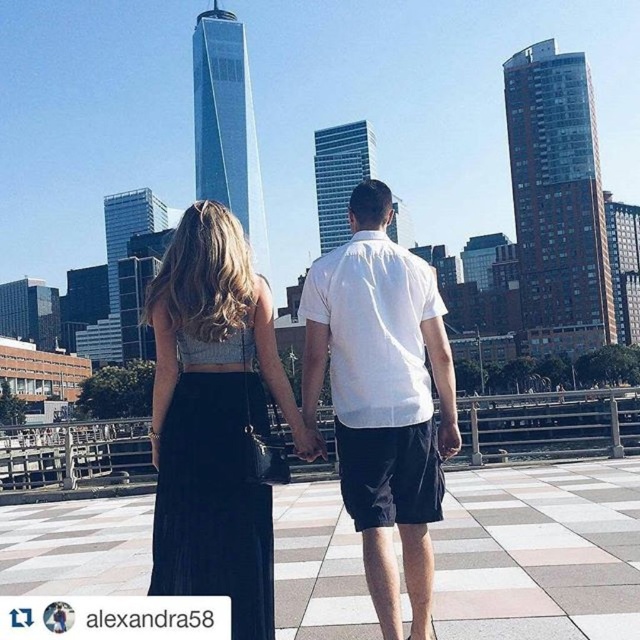
You are a photographer trying to capture the couple in the scene. You notice the satin black skirt at center and the white cotton shirt at center. Which clothing item is located to the left when looking at the couple from the front?

The satin black skirt at center is positioned on the left side of white cotton shirt at center, so when viewed from the front, the satin black skirt at center is to the left of the white cotton shirt at center.

You are a photographer trying to capture a candid shot of the couple in the scene. You notice the satin black skirt at center and the matte black hand at center. To ensure both elements are in focus, you need to know their distance apart. Can you determine if they are within the camera lens depth of field range of 30 inches?

The satin black skirt at center and the matte black hand at center are 33.61 inches apart. Since the distance exceeds the 30 inches depth of field range, they might not both be in focus simultaneously.

You are taking a photo of the couple in the scene. You want to focus on the point closer to the camera. Which point should you choose between point (323, 328) and point (324, 449)?

Point (323, 328) is closer to the camera than point (324, 449), so you should focus on point (323, 328).